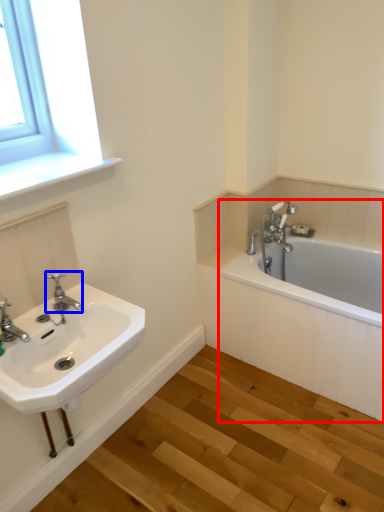
Question: Which point is further to the camera, bathtub (highlighted by a red box) or tap (highlighted by a blue box)?

Choices:
 (A) bathtub
 (B) tap

Answer: (A)